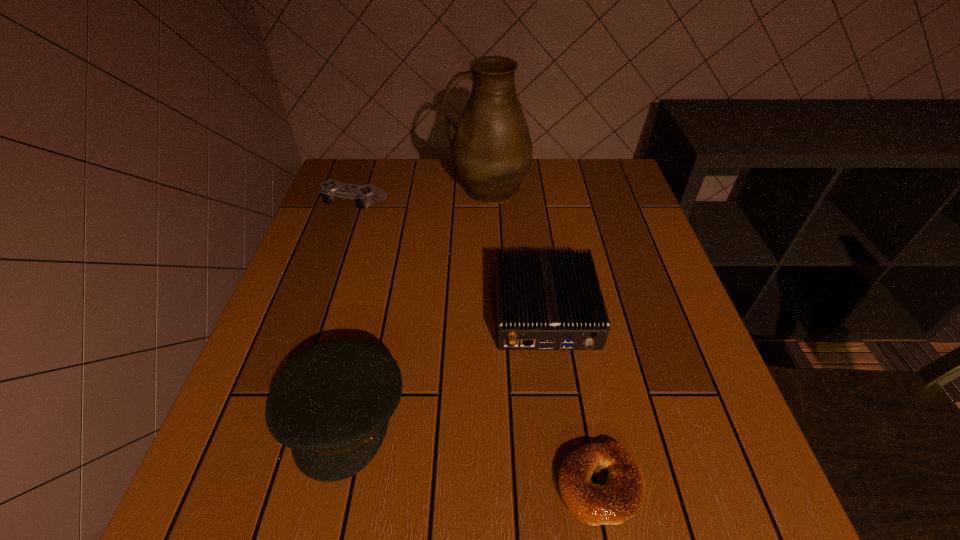
Where is `vacant space situated on the right of the second shortest object`? This screenshot has height=540, width=960. vacant space situated on the right of the second shortest object is located at coordinates (420, 202).

This screenshot has height=540, width=960. What are the coordinates of `vacant space located on the left of the shortest object` in the screenshot? It's located at (351, 484).

Find the location of a particular element. pitcher positioned at the far edge is located at coordinates (491, 147).

This screenshot has height=540, width=960. In order to click on control that is at the far edge in this screenshot , I will do `click(365, 195)`.

Locate an element on the screen. The image size is (960, 540). beret at the near edge is located at coordinates [x=331, y=405].

The image size is (960, 540). I want to click on bagel that is at the near edge, so click(621, 497).

Image resolution: width=960 pixels, height=540 pixels. Find the location of `beret that is at the left edge`. beret that is at the left edge is located at coordinates (331, 405).

The height and width of the screenshot is (540, 960). Find the location of `control positioned at the left edge`. control positioned at the left edge is located at coordinates (365, 195).

Identify the location of object positioned at the far left corner. The height and width of the screenshot is (540, 960). (365, 195).

The image size is (960, 540). Find the location of `object at the near left corner`. object at the near left corner is located at coordinates pos(331,405).